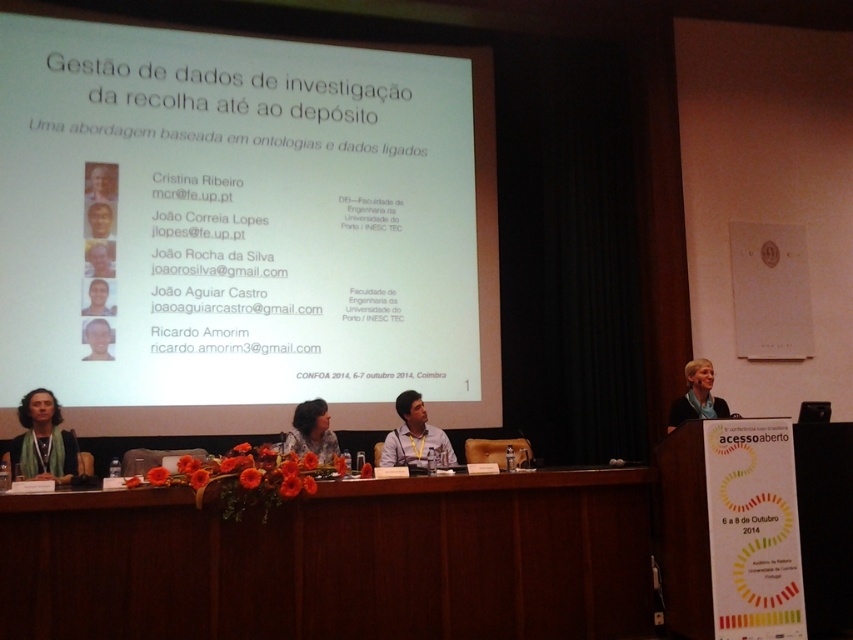
Is point (59, 429) positioned before point (103, 356)?

Yes, it is in front of point (103, 356).

In the scene shown: Is green scarf at lower left bigger than light brown skin at center?

Indeed, green scarf at lower left has a larger size compared to light brown skin at center.

Between point (41, 433) and point (108, 332), which one is positioned behind?

Positioned behind is point (108, 332).

Locate an element on the screen. green scarf at lower left is located at coordinates (44, 440).

From the picture: Who is taller, matte black hair at center or matte black laptop at upper left?

With more height is matte black hair at center.

Can you confirm if matte black hair at center is bigger than matte black laptop at upper left?

Yes.

Locate an element on the screen. Image resolution: width=853 pixels, height=640 pixels. matte black hair at center is located at coordinates (311, 432).

Where is `matte black hair at center`? This screenshot has height=640, width=853. matte black hair at center is located at coordinates (311, 432).

Is the position of matte black laptop at center more distant than that of matte black headshot at center?

Yes, matte black laptop at center is behind matte black headshot at center.

Describe the element at coordinates (99, 259) in the screenshot. The width and height of the screenshot is (853, 640). I see `matte black laptop at center` at that location.

You are a GUI agent. You are given a task and a screenshot of the screen. Output one action in this format:
    pyautogui.click(x=<x>, y=<y>)
    Task: Click on the matte black laptop at center
    
    Given the screenshot: What is the action you would take?
    pyautogui.click(x=99, y=259)